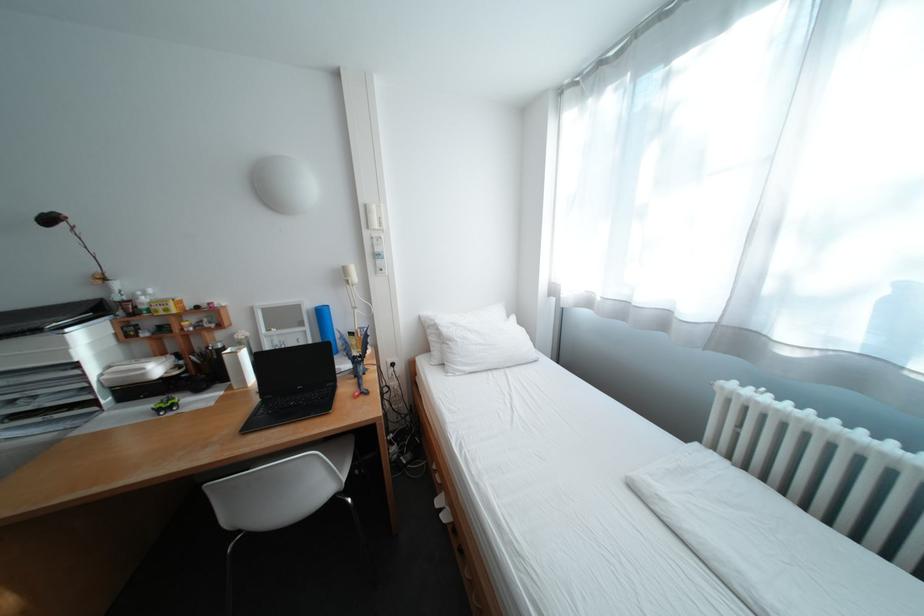
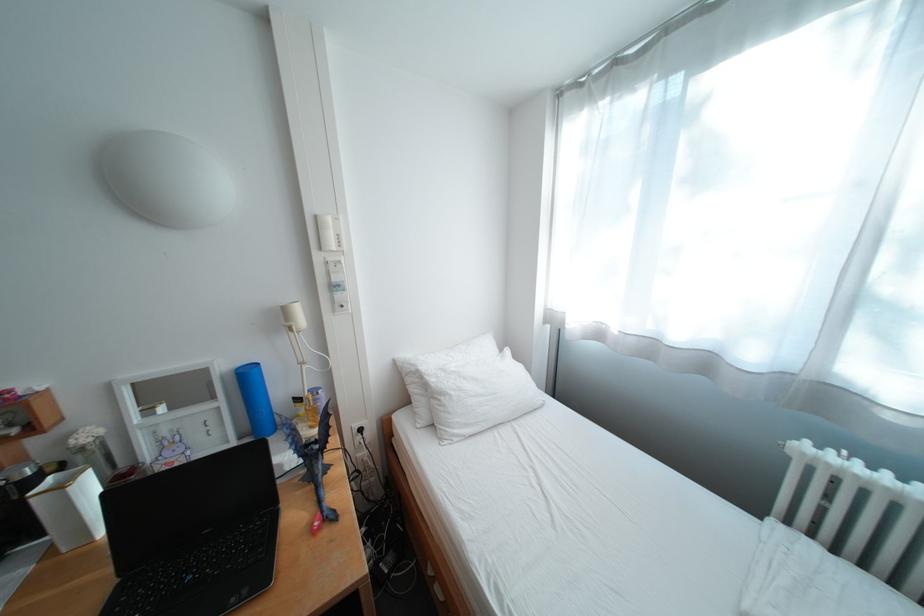
Question: The camera is either moving clockwise (left) or counter-clockwise (right) around the object. The first image is from the beginning of the video and the second image is from the end. Is the camera moving left or right when shooting the video?

Choices:
 (A) Left
 (B) Right

Answer: (A)